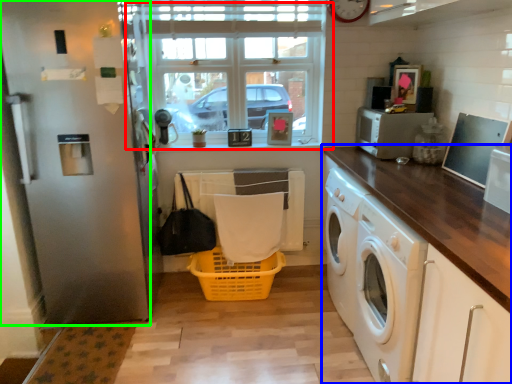
Question: Which object is positioned closest to window (highlighted by a red box)? Select from countertop (highlighted by a blue box) and screen door (highlighted by a green box).

Choices:
 (A) countertop
 (B) screen door

Answer: (B)